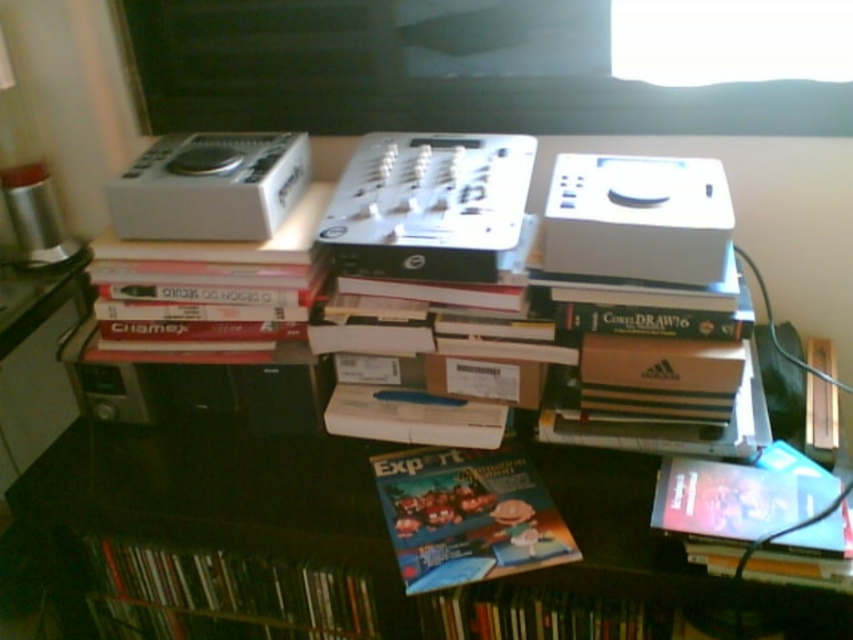
Does matte plastic book at lower left appear over matte plastic book at lower right?

No.

Describe the element at coordinates (231, 589) in the screenshot. I see `matte plastic book at lower left` at that location.

From the picture: Who is more distant from viewer, (161, 547) or (744, 484)?

The point (161, 547) is behind.

At what (x,y) coordinates should I click in order to perform the action: click on matte plastic book at lower left. Please return your answer as a coordinate pair (x, y). The width and height of the screenshot is (853, 640). Looking at the image, I should click on (231, 589).

Which is above, matte black magazine at center or matte plastic book at lower right?

matte plastic book at lower right is above.

Which is behind, point (805, 611) or point (842, 518)?

Positioned behind is point (842, 518).

The image size is (853, 640). I want to click on matte black magazine at center, so click(x=213, y=499).

Between matte black magazine at center and matte plastic book at lower left, which one appears on the left side from the viewer's perspective?

From the viewer's perspective, matte plastic book at lower left appears more on the left side.

Who is positioned more to the right, matte black magazine at center or matte plastic book at lower left?

matte black magazine at center is more to the right.

Does point (251, 525) lie in front of point (329, 598)?

Yes, point (251, 525) is closer to viewer.

Image resolution: width=853 pixels, height=640 pixels. Identify the location of matte black magazine at center. (213, 499).